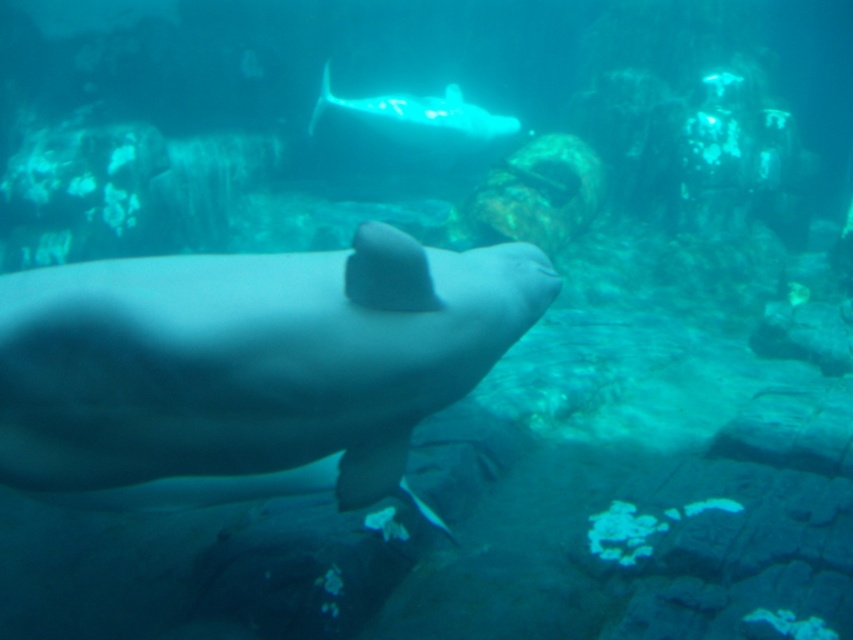
Question: Which of the following is the closest to the observer?

Choices:
 (A) smooth gray whale at center
 (B) translucent white whale at center

Answer: (A)

Question: Which point appears farthest from the camera in this image?

Choices:
 (A) (366, 339)
 (B) (358, 120)

Answer: (B)

Question: Can you confirm if smooth gray whale at center is positioned below translucent white whale at center?

Choices:
 (A) yes
 (B) no

Answer: (A)

Question: Does smooth gray whale at center have a greater width compared to translucent white whale at center?

Choices:
 (A) yes
 (B) no

Answer: (B)

Question: Is smooth gray whale at center bigger than translucent white whale at center?

Choices:
 (A) no
 (B) yes

Answer: (A)